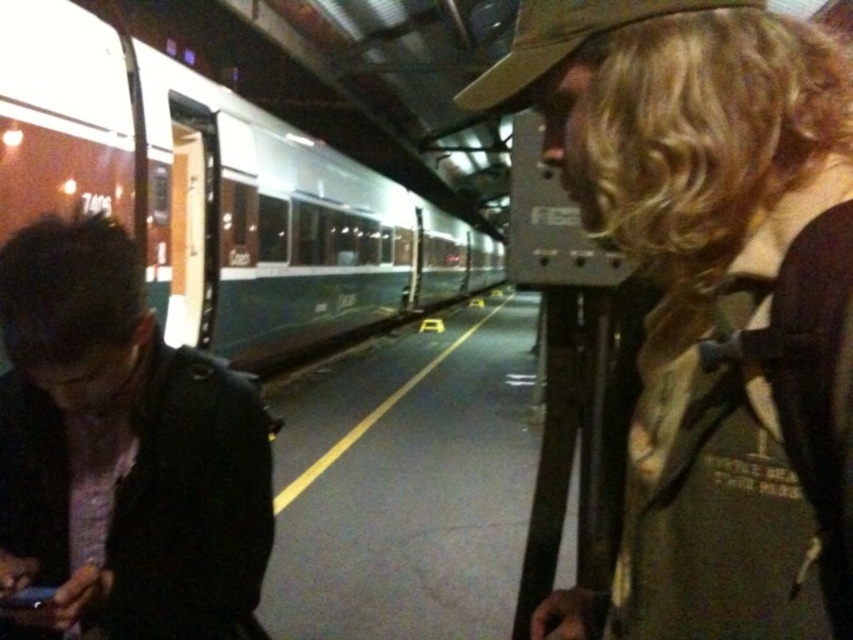
You are standing on the train station platform and want to determine the relative positions of two points marked on the platform. Which point is closer to you, point (582, 188) or point (306, 209)?

Point (582, 188) is closer to the viewer than point (306, 209).

You are standing at the point marked as point [213,193] on the train station platform. Looking around, you see the green matte train at left. What is the direction of the green matte train relative to your current position?

The green matte train at left is located to your left side relative to your position at point [213,193].